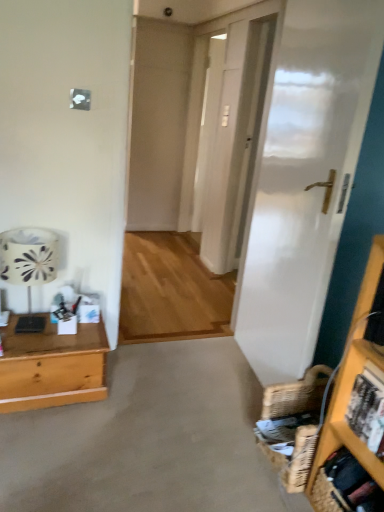
Find the location of a particular element. The image size is (384, 512). vacant area in front of wooden desk at left is located at coordinates (55, 442).